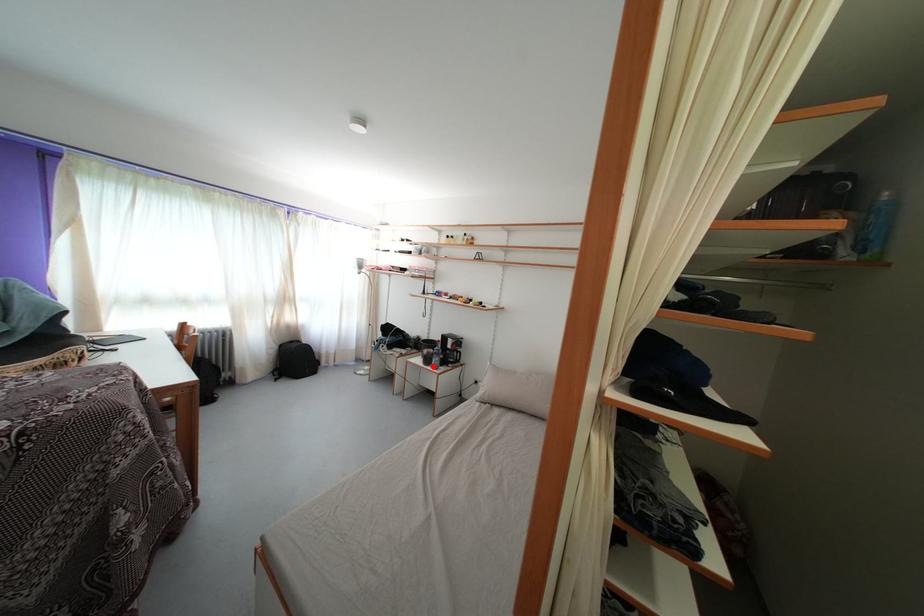
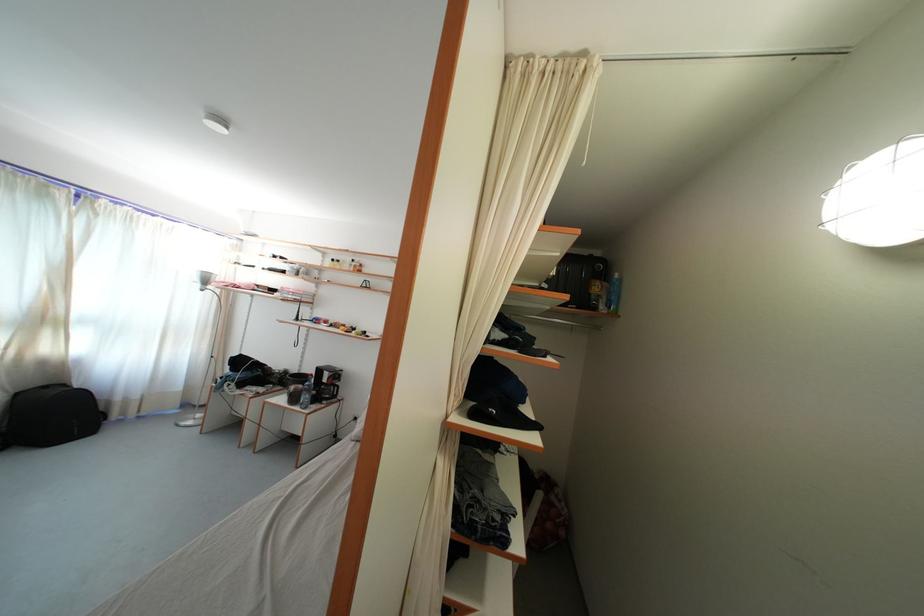
Locate, in the second image, the point that corresponds to the highlighted location in the first image.

(300, 405)